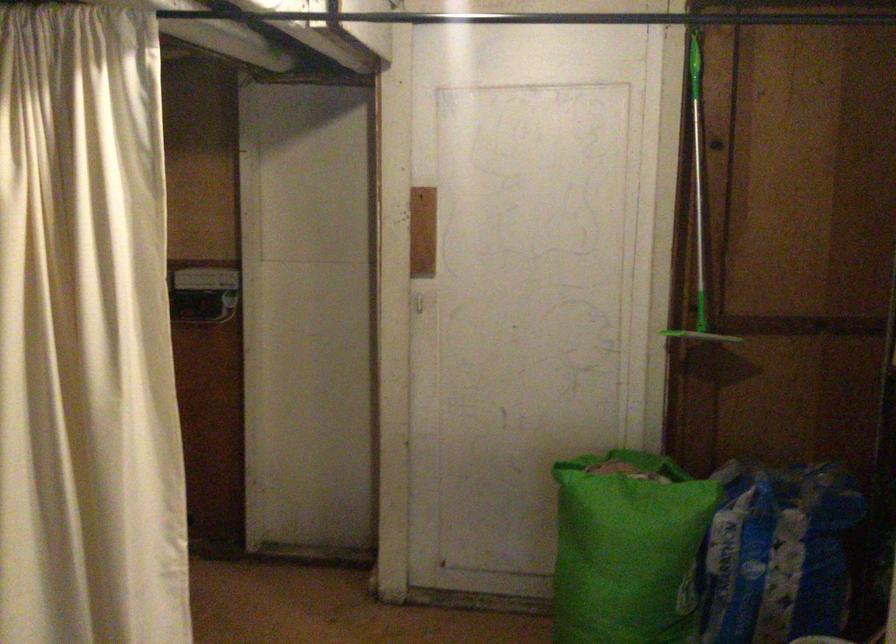
The image size is (896, 644). I want to click on wooden door handle, so click(421, 299).